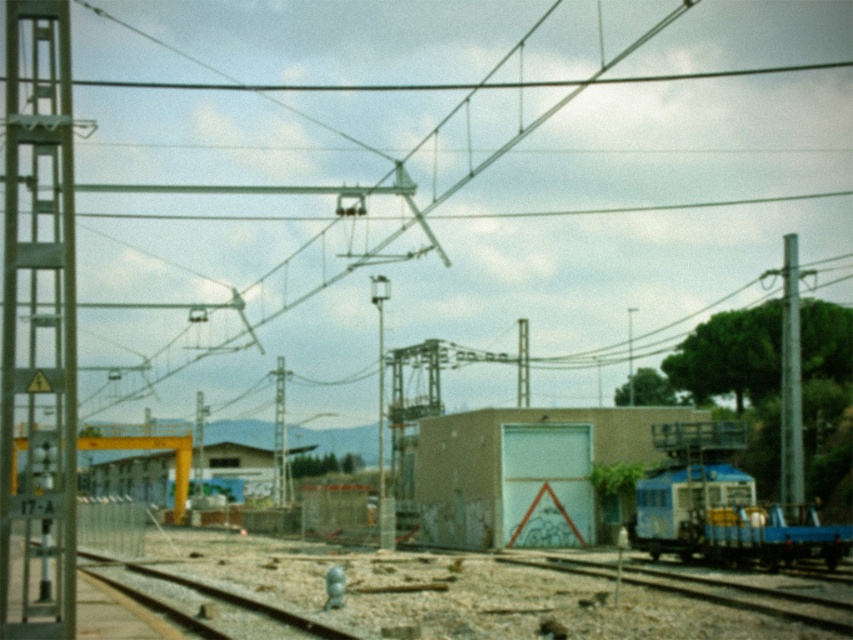
Which is below, blue metallic train at lower right or metallic pole at right?

blue metallic train at lower right

Who is shorter, blue metallic train at lower right or metallic pole at right?

blue metallic train at lower right

Does point (679, 508) lie in front of point (786, 346)?

Yes, it is.

What are the coordinates of `blue metallic train at lower right` in the screenshot? It's located at (726, 520).

Who is taller, light brown concrete building at center or smooth metal rail at center?

light brown concrete building at center is taller.

Can you confirm if light brown concrete building at center is positioned to the left of smooth metal rail at center?

No, light brown concrete building at center is not to the left of smooth metal rail at center.

This screenshot has width=853, height=640. What are the coordinates of `light brown concrete building at center` in the screenshot? It's located at (524, 472).

Can you confirm if light brown concrete building at center is smaller than blue metallic train at lower right?

Incorrect, light brown concrete building at center is not smaller in size than blue metallic train at lower right.

At what (x,y) coordinates should I click in order to perform the action: click on light brown concrete building at center. Please return your answer as a coordinate pair (x, y). The width and height of the screenshot is (853, 640). Looking at the image, I should click on (524, 472).

Is point (624, 445) positioned in front of point (672, 540)?

That is False.

Identify the location of light brown concrete building at center. (524, 472).